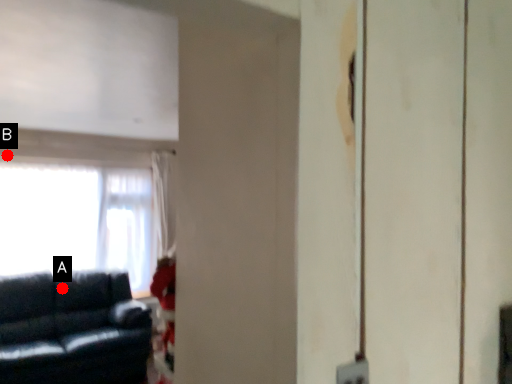
Question: Two points are circled on the image, labeled by A and B beside each circle. Which point appears closest to the camera in this image?

Choices:
 (A) A is closer
 (B) B is closer

Answer: (A)